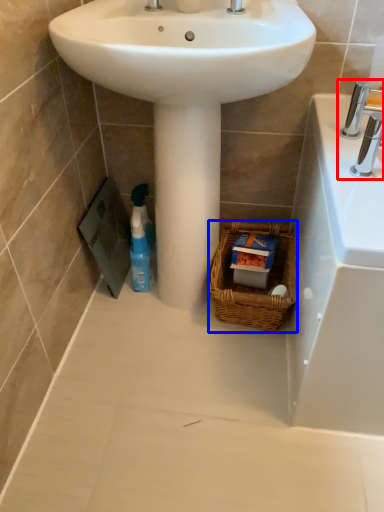
Question: Which object appears farthest to the camera in this image, tap (highlighted by a red box) or basket (highlighted by a blue box)?

Choices:
 (A) tap
 (B) basket

Answer: (B)